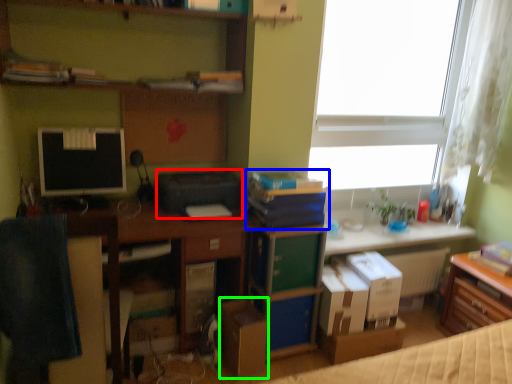
Question: Which is farther away from printer (highlighted by a red box)? book (highlighted by a blue box) or cardboard box (highlighted by a green box)?

Choices:
 (A) book
 (B) cardboard box

Answer: (B)